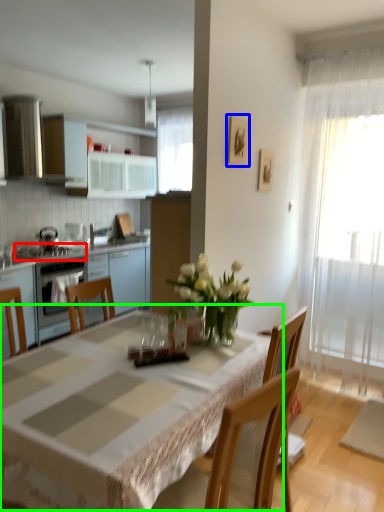
Question: Which object is positioned closest to gas stove (highlighted by a red box)? Select from picture frame (highlighted by a blue box) and table (highlighted by a green box).

Choices:
 (A) picture frame
 (B) table

Answer: (A)